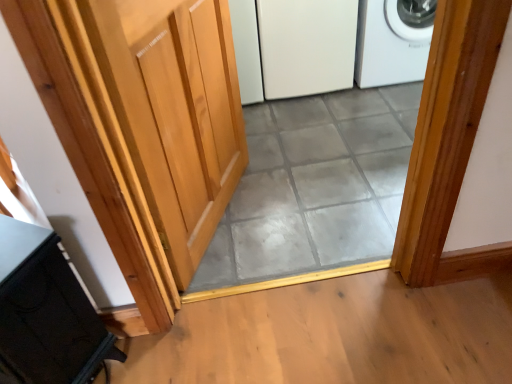
This screenshot has height=384, width=512. What do you see at coordinates (46, 313) in the screenshot?
I see `black matte cabinet at lower left` at bounding box center [46, 313].

Describe the element at coordinates (314, 192) in the screenshot. The image size is (512, 384). I see `gray tile at center` at that location.

In order to click on light wood door at center in this screenshot , I will do `click(175, 111)`.

At what (x,y) coordinates should I click in order to perform the action: click on white matte refrigerator at center. Please return your answer as a coordinate pair (x, y). This screenshot has height=384, width=512. Looking at the image, I should click on (306, 46).

Could you tell me if white matte refrigerator at center is facing light wood door at center?

Yes.

From the image's perspective, is white matte refrigerator at center positioned above or below light wood door at center?

white matte refrigerator at center is above light wood door at center.

Based on the photo, which object is closer to the camera taking this photo, white matte refrigerator at center or light wood door at center?

Positioned in front is light wood door at center.

Image resolution: width=512 pixels, height=384 pixels. I want to click on screen door that is under the light wood door at center (from a real-world perspective), so click(x=306, y=46).

Is light wood door at center oriented away from white matte refrigerator at center?

light wood door at center does not have its back to white matte refrigerator at center.

Consider the image. From the image's perspective, does light wood door at center appear lower than white matte refrigerator at center?

Yes, from the image's perspective, light wood door at center is below white matte refrigerator at center.

Between point (184, 288) and point (321, 32), which one is positioned behind?

Point (321, 32)

How distant is light wood door at center from white matte refrigerator at center?

light wood door at center and white matte refrigerator at center are 32.77 inches apart.

Between black matte cabinet at lower left and white plastic washing machine at upper right, which one has smaller size?

black matte cabinet at lower left is smaller.

Considering the sizes of objects black matte cabinet at lower left and white plastic washing machine at upper right in the image provided, who is shorter, black matte cabinet at lower left or white plastic washing machine at upper right?

Standing shorter between the two is white plastic washing machine at upper right.

Is point (6, 353) in front of point (389, 71)?

Yes, point (6, 353) is closer to viewer.

From a real-world perspective, is black matte cabinet at lower left positioned above or below white plastic washing machine at upper right?

Clearly, from a real-world perspective, black matte cabinet at lower left is above white plastic washing machine at upper right.

From a real-world perspective, is white plastic washing machine at upper right physically above black matte cabinet at lower left?

No, from a real-world perspective, white plastic washing machine at upper right is not over black matte cabinet at lower left

Does white plastic washing machine at upper right appear on the right side of black matte cabinet at lower left?

Yes, white plastic washing machine at upper right is to the right of black matte cabinet at lower left.

Could you tell me if white plastic washing machine at upper right is turned towards black matte cabinet at lower left?

No, white plastic washing machine at upper right is not aimed at black matte cabinet at lower left.

Which of these two, white plastic washing machine at upper right or black matte cabinet at lower left, is bigger?

white plastic washing machine at upper right.

From the picture: Which object is thinner, white plastic washing machine at upper right or white matte refrigerator at center?

white matte refrigerator at center.

Is white matte refrigerator at center at the back of white plastic washing machine at upper right?

No, white plastic washing machine at upper right is not facing the opposite direction of white matte refrigerator at center.

Who is taller, white plastic washing machine at upper right or white matte refrigerator at center?

white matte refrigerator at center.

From a real-world perspective, which is physically above, white plastic washing machine at upper right or white matte refrigerator at center?

In real-world perspective, white matte refrigerator at center is above.

Considering the sizes of gray tile at center and white plastic washing machine at upper right in the image, is gray tile at center bigger or smaller than white plastic washing machine at upper right?

Clearly, gray tile at center is smaller in size than white plastic washing machine at upper right.

Is gray tile at center situated inside white plastic washing machine at upper right or outside?

gray tile at center exists outside the volume of white plastic washing machine at upper right.

The height and width of the screenshot is (384, 512). I want to click on home appliance behind the gray tile at center, so click(393, 41).

Which is more to the left, gray tile at center or white plastic washing machine at upper right?

gray tile at center is more to the left.

Considering the sizes of objects white plastic washing machine at upper right and gray tile at center in the image provided, who is shorter, white plastic washing machine at upper right or gray tile at center?

gray tile at center.

Looking at this image, from a real-world perspective, relative to gray tile at center, is white plastic washing machine at upper right vertically above or below?

From a real-world perspective, white plastic washing machine at upper right is physically above gray tile at center.

In the scene shown: From the image's perspective, which one is positioned lower, white plastic washing machine at upper right or gray tile at center?

gray tile at center is shown below in the image.

Are white plastic washing machine at upper right and gray tile at center far apart?

That's not correct — white plastic washing machine at upper right is a little close to gray tile at center.

Locate an element on the screen. The image size is (512, 384). screen door above the light wood door at center (from the image's perspective) is located at coordinates (306, 46).

Where is `door lying below the white matte refrigerator at center (from the image's perspective)`? door lying below the white matte refrigerator at center (from the image's perspective) is located at coordinates (175, 111).

Looking at the image, which one is located closer to light wood door at center, white matte refrigerator at center or white plastic washing machine at upper right?

Based on the image, white matte refrigerator at center appears to be nearer to light wood door at center.

Based on their spatial positions, is gray tile at center or black matte cabinet at lower left closer to light wood door at center?

Based on the image, gray tile at center appears to be nearer to light wood door at center.

Looking at the image, which one is located further to white matte refrigerator at center, gray tile at center or black matte cabinet at lower left?

Based on the image, black matte cabinet at lower left appears to be further to white matte refrigerator at center.

Which object lies nearer to the anchor point light wood door at center, white plastic washing machine at upper right or black matte cabinet at lower left?

The object closer to light wood door at center is black matte cabinet at lower left.

Which object lies nearer to the anchor point white matte refrigerator at center, black matte cabinet at lower left or gray tile at center?

gray tile at center is closer to white matte refrigerator at center.

Which object lies nearer to the anchor point gray tile at center, black matte cabinet at lower left or white matte refrigerator at center?

white matte refrigerator at center is closer to gray tile at center.

Considering their positions, is gray tile at center positioned closer to white plastic washing machine at upper right than white matte refrigerator at center?

white matte refrigerator at center lies closer to white plastic washing machine at upper right than the other object.

Looking at this image, which object lies nearer to the anchor point white matte refrigerator at center, gray tile at center or light wood door at center?

The object closer to white matte refrigerator at center is gray tile at center.

At what (x,y) coordinates should I click in order to perform the action: click on door positioned between black matte cabinet at lower left and white matte refrigerator at center from near to far. Please return your answer as a coordinate pair (x, y). The image size is (512, 384). Looking at the image, I should click on (175, 111).

Identify the location of tile between light wood door at center and white plastic washing machine at upper right along the z-axis. (314, 192).

At what (x,y) coordinates should I click in order to perform the action: click on door between black matte cabinet at lower left and gray tile at center in the horizontal direction. Please return your answer as a coordinate pair (x, y). Image resolution: width=512 pixels, height=384 pixels. Looking at the image, I should click on (175, 111).

At what (x,y) coordinates should I click in order to perform the action: click on tile positioned between light wood door at center and white matte refrigerator at center from near to far. Please return your answer as a coordinate pair (x, y). Looking at the image, I should click on (314, 192).